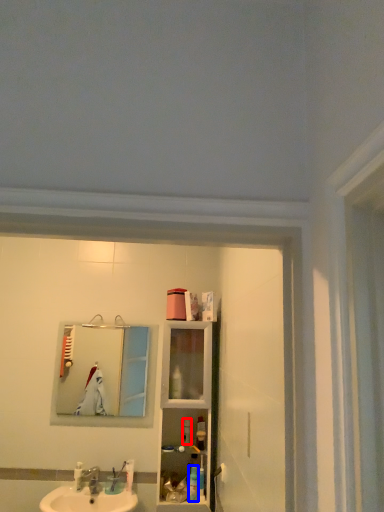
Question: Which object is further to the camera taking this photo, toiletry (highlighted by a red box) or toiletry (highlighted by a blue box)?

Choices:
 (A) toiletry
 (B) toiletry

Answer: (A)